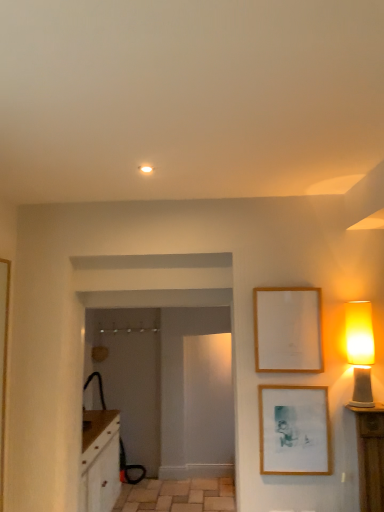
What are the coordinates of `matte wooden picture frame at lower right, the second picture frame when ordered from top to bottom` in the screenshot? It's located at (294, 430).

Locate an element on the screen. This screenshot has height=512, width=384. matte wooden picture frame at lower right, positioned as the 1th picture frame in bottom-to-top order is located at coordinates (294, 430).

From the image's perspective, between matte yellow glass lampshade at right and wooden picture frame at upper right, which ranks as the second picture frame in bottom-to-top order, who is located below?

matte yellow glass lampshade at right, from the image's perspective.

Do you think matte yellow glass lampshade at right is within wooden picture frame at upper right, which ranks as the second picture frame in bottom-to-top order, or outside of it?

matte yellow glass lampshade at right is spatially situated outside wooden picture frame at upper right, which ranks as the second picture frame in bottom-to-top order.

Locate an element on the screen. The image size is (384, 512). table lamp that is on the right side of wooden picture frame at upper right, the first picture frame in the top-to-bottom sequence is located at coordinates (360, 350).

Who is bigger, matte yellow glass lampshade at right or wooden picture frame at upper right, which ranks as the second picture frame in bottom-to-top order?

With larger size is matte yellow glass lampshade at right.

From a real-world perspective, starting from the natural stone tile at lower center, which picture frame is the 2nd one vertically above it? Please provide its 2D coordinates.

[(288, 329)]

From the image's perspective, which is below, natural stone tile at lower center or wooden picture frame at upper right, the first picture frame in the top-to-bottom sequence?

natural stone tile at lower center.

Who is more distant, natural stone tile at lower center or wooden picture frame at upper right, which ranks as the second picture frame in bottom-to-top order?

natural stone tile at lower center.

Does point (190, 500) come in front of point (271, 296)?

No, (190, 500) is behind (271, 296).

Is wooden picture frame at upper right, which ranks as the second picture frame in bottom-to-top order, positioned far away from matte yellow glass lampshade at right?

wooden picture frame at upper right, which ranks as the second picture frame in bottom-to-top order, is actually quite close to matte yellow glass lampshade at right.

From the image's perspective, would you say wooden picture frame at upper right, which ranks as the second picture frame in bottom-to-top order, is shown under matte yellow glass lampshade at right?

No, from the image's perspective, wooden picture frame at upper right, which ranks as the second picture frame in bottom-to-top order, is not below matte yellow glass lampshade at right.

Is wooden picture frame at upper right, the first picture frame in the top-to-bottom sequence, completely or partially outside of matte yellow glass lampshade at right?

wooden picture frame at upper right, the first picture frame in the top-to-bottom sequence, is positioned outside matte yellow glass lampshade at right.

Based on the photo, from a real-world perspective, is matte yellow glass lampshade at right positioned over matte wooden picture frame at lower right, positioned as the 1th picture frame in bottom-to-top order, based on gravity?

Yes, from a real-world perspective, matte yellow glass lampshade at right is over matte wooden picture frame at lower right, positioned as the 1th picture frame in bottom-to-top order

In terms of size, does matte yellow glass lampshade at right appear bigger or smaller than matte wooden picture frame at lower right, the second picture frame when ordered from top to bottom?

Clearly, matte yellow glass lampshade at right is larger in size than matte wooden picture frame at lower right, the second picture frame when ordered from top to bottom.

Are matte yellow glass lampshade at right and matte wooden picture frame at lower right, positioned as the 1th picture frame in bottom-to-top order, located far from each other?

No.

Is wooden picture frame at upper right, which ranks as the second picture frame in bottom-to-top order, aimed at matte wooden picture frame at lower right, positioned as the 1th picture frame in bottom-to-top order?

No, wooden picture frame at upper right, which ranks as the second picture frame in bottom-to-top order, is not oriented towards matte wooden picture frame at lower right, positioned as the 1th picture frame in bottom-to-top order.

Is wooden picture frame at upper right, which ranks as the second picture frame in bottom-to-top order, positioned beyond the bounds of matte wooden picture frame at lower right, the second picture frame when ordered from top to bottom?

Yes, wooden picture frame at upper right, which ranks as the second picture frame in bottom-to-top order, is located beyond the bounds of matte wooden picture frame at lower right, the second picture frame when ordered from top to bottom.

Which point is more distant from viewer, (289,289) or (264,391)?

The point (289,289) is behind.

Is the surface of wooden picture frame at upper right, the first picture frame in the top-to-bottom sequence, in direct contact with matte wooden picture frame at lower right, positioned as the 1th picture frame in bottom-to-top order?

There is a gap between wooden picture frame at upper right, the first picture frame in the top-to-bottom sequence, and matte wooden picture frame at lower right, positioned as the 1th picture frame in bottom-to-top order.

Which is in front, point (146, 504) or point (259, 394)?

The point (259, 394) is closer.

Based on their positions, is natural stone tile at lower center located to the left or right of matte wooden picture frame at lower right, the second picture frame when ordered from top to bottom?

From the image, it's evident that natural stone tile at lower center is to the left of matte wooden picture frame at lower right, the second picture frame when ordered from top to bottom.

From a real-world perspective, is natural stone tile at lower center over matte wooden picture frame at lower right, positioned as the 1th picture frame in bottom-to-top order?

Actually, natural stone tile at lower center is physically below matte wooden picture frame at lower right, positioned as the 1th picture frame in bottom-to-top order, in the real world.

Is point (358, 380) farther from viewer compared to point (219, 490)?

No, it is not.

Between matte yellow glass lampshade at right and natural stone tile at lower center, which one appears on the left side from the viewer's perspective?

From the viewer's perspective, natural stone tile at lower center appears more on the left side.

Are matte yellow glass lampshade at right and natural stone tile at lower center located far from each other?

Yes.

You are a GUI agent. You are given a task and a screenshot of the screen. Output one action in this format:
    pyautogui.click(x=<x>, y=<y>)
    Task: Click on the table lamp located underneath the wooden picture frame at upper right, which ranks as the second picture frame in bottom-to-top order (from a real-world perspective)
    This screenshot has width=384, height=512.
    Given the screenshot: What is the action you would take?
    coord(360,350)

In order to click on the 2nd picture frame positioned above the natural stone tile at lower center (from the image's perspective) in this screenshot , I will do `click(288, 329)`.

Based on their spatial positions, is matte wooden picture frame at lower right, positioned as the 1th picture frame in bottom-to-top order, or matte yellow glass lampshade at right further from wooden picture frame at upper right, which ranks as the second picture frame in bottom-to-top order?

matte wooden picture frame at lower right, positioned as the 1th picture frame in bottom-to-top order, is positioned further to the anchor wooden picture frame at upper right, which ranks as the second picture frame in bottom-to-top order.

Looking at the image, which one is located closer to wooden picture frame at upper right, which ranks as the second picture frame in bottom-to-top order, matte yellow glass lampshade at right or matte wooden picture frame at lower right, positioned as the 1th picture frame in bottom-to-top order?

matte yellow glass lampshade at right lies closer to wooden picture frame at upper right, which ranks as the second picture frame in bottom-to-top order, than the other object.

Considering their positions, is wooden picture frame at upper right, which ranks as the second picture frame in bottom-to-top order, positioned closer to matte yellow glass lampshade at right than natural stone tile at lower center?

wooden picture frame at upper right, which ranks as the second picture frame in bottom-to-top order, is positioned closer to the anchor matte yellow glass lampshade at right.

Which object lies further to the anchor point natural stone tile at lower center, matte yellow glass lampshade at right or matte wooden picture frame at lower right, positioned as the 1th picture frame in bottom-to-top order?

matte yellow glass lampshade at right is further to natural stone tile at lower center.

Based on their spatial positions, is wooden picture frame at upper right, which ranks as the second picture frame in bottom-to-top order, or matte yellow glass lampshade at right further from natural stone tile at lower center?

The object further to natural stone tile at lower center is matte yellow glass lampshade at right.

Looking at the image, which one is located further to wooden picture frame at upper right, which ranks as the second picture frame in bottom-to-top order, natural stone tile at lower center or matte yellow glass lampshade at right?

The object further to wooden picture frame at upper right, which ranks as the second picture frame in bottom-to-top order, is natural stone tile at lower center.

Which object lies further to the anchor point wooden picture frame at upper right, which ranks as the second picture frame in bottom-to-top order, matte wooden picture frame at lower right, positioned as the 1th picture frame in bottom-to-top order, or natural stone tile at lower center?

Among the two, natural stone tile at lower center is located further to wooden picture frame at upper right, which ranks as the second picture frame in bottom-to-top order.

From the image, which object appears to be farther from matte wooden picture frame at lower right, the second picture frame when ordered from top to bottom, matte yellow glass lampshade at right or natural stone tile at lower center?

Answer: natural stone tile at lower center.

This screenshot has width=384, height=512. In order to click on picture frame between matte yellow glass lampshade at right and natural stone tile at lower center from top to bottom in this screenshot , I will do `click(294, 430)`.

The height and width of the screenshot is (512, 384). Find the location of `table lamp between wooden picture frame at upper right, the first picture frame in the top-to-bottom sequence, and natural stone tile at lower center in the up-down direction`. table lamp between wooden picture frame at upper right, the first picture frame in the top-to-bottom sequence, and natural stone tile at lower center in the up-down direction is located at coordinates (360, 350).

Find the location of a particular element. The width and height of the screenshot is (384, 512). table lamp between wooden picture frame at upper right, which ranks as the second picture frame in bottom-to-top order, and matte wooden picture frame at lower right, positioned as the 1th picture frame in bottom-to-top order, from top to bottom is located at coordinates (360, 350).

Identify the location of picture frame between wooden picture frame at upper right, which ranks as the second picture frame in bottom-to-top order, and natural stone tile at lower center in the up-down direction. This screenshot has height=512, width=384. (294, 430).